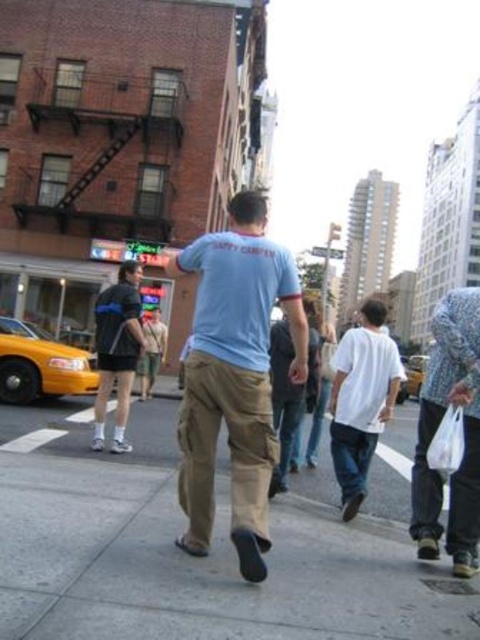
The width and height of the screenshot is (480, 640). What do you see at coordinates (235, 376) in the screenshot?
I see `light blue cotton t-shirt at center` at bounding box center [235, 376].

Does light blue cotton t-shirt at center have a greater width compared to khaki pants at center?

Incorrect, light blue cotton t-shirt at center's width does not surpass khaki pants at center's.

Between point (307, 353) and point (192, 372), which one is positioned in front?

Positioned in front is point (192, 372).

The width and height of the screenshot is (480, 640). What are the coordinates of `light blue cotton t-shirt at center` in the screenshot? It's located at (235, 376).

Does floral-patterned shirt at right lie behind yellow matte taxi at lower left?

No, it is not.

Who is lower down, floral-patterned shirt at right or yellow matte taxi at lower left?

floral-patterned shirt at right is below.

Does point (437, 476) come farther from viewer compared to point (43, 353)?

No, (437, 476) is in front of (43, 353).

Find the location of `floral-patterned shirt at right`. floral-patterned shirt at right is located at coordinates (464, 435).

Who is positioned more to the right, tan fabric pants at center or khaki pants at center?

From the viewer's perspective, khaki pants at center appears more on the right side.

Find the location of a particular element. Image resolution: width=480 pixels, height=640 pixels. tan fabric pants at center is located at coordinates (190, 557).